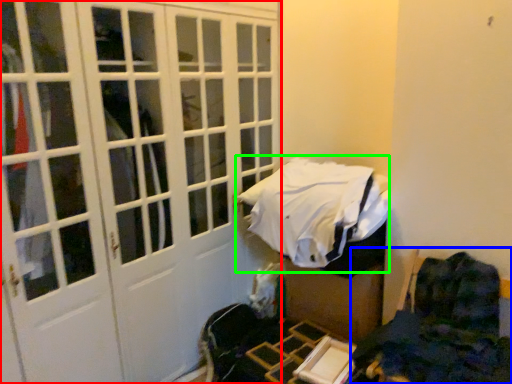
Question: Which object is positioned closest to door (highlighted by a red box)? Select from furniture (highlighted by a blue box) and bed (highlighted by a green box).

Choices:
 (A) furniture
 (B) bed

Answer: (B)